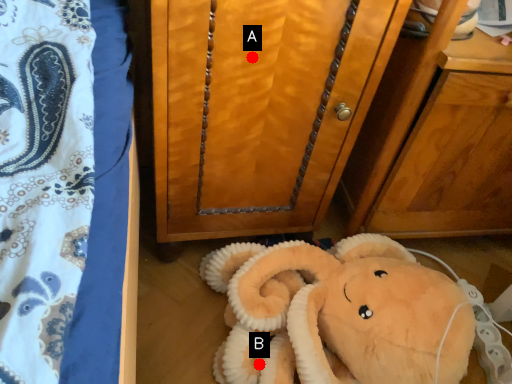
Question: Two points are circled on the image, labeled by A and B beside each circle. Which point appears closest to the camera in this image?

Choices:
 (A) A is closer
 (B) B is closer

Answer: (A)